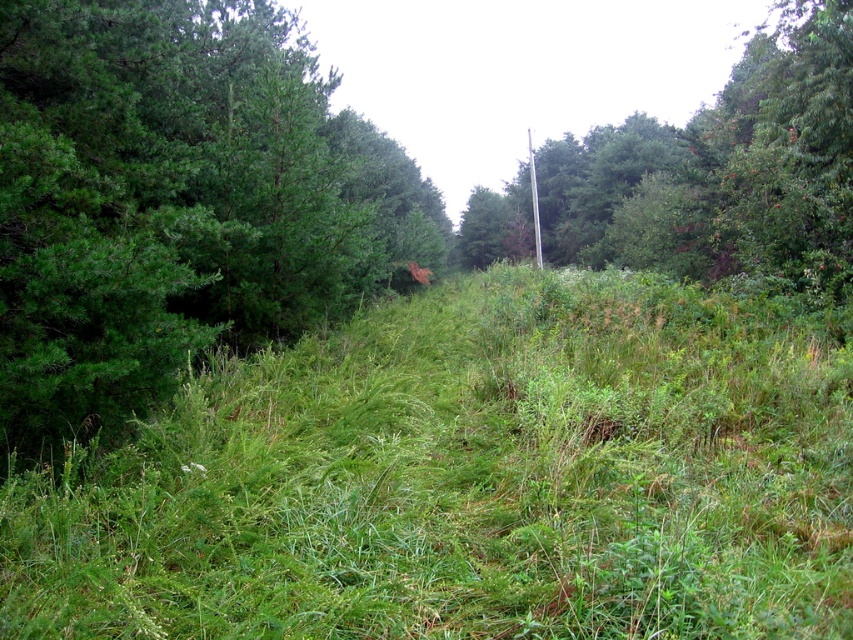
Question: Which object appears farthest from the camera in this image?

Choices:
 (A) green matte tree at upper center
 (B) green grassy at center

Answer: (A)

Question: Which point is closer to the camera taking this photo?

Choices:
 (A) (729, 593)
 (B) (730, 252)

Answer: (A)

Question: Among these points, which one is farthest from the camera?

Choices:
 (A) 222,403
 (B) 682,170

Answer: (B)

Question: Is green grassy at center closer to camera compared to green matte tree at upper center?

Choices:
 (A) no
 (B) yes

Answer: (B)

Question: Observing the image, what is the correct spatial positioning of green grassy at center in reference to green matte tree at upper center?

Choices:
 (A) below
 (B) above

Answer: (A)

Question: Can you confirm if green grassy at center is smaller than green matte tree at upper center?

Choices:
 (A) yes
 (B) no

Answer: (A)